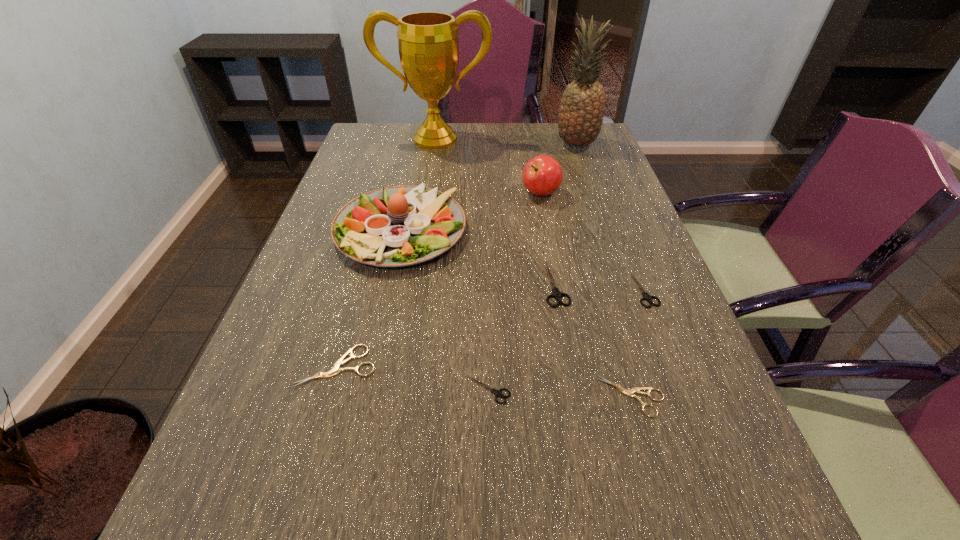
At what (x,y) coordinates should I click in order to perform the action: click on gold award. Please return your answer as a coordinate pair (x, y). Looking at the image, I should click on (428, 44).

You are a GUI agent. You are given a task and a screenshot of the screen. Output one action in this format:
    pyautogui.click(x=<x>, y=<y>)
    Task: Click on the pineapple
    
    Given the screenshot: What is the action you would take?
    pyautogui.click(x=580, y=118)

The image size is (960, 540). What are the coordinates of `red apple` in the screenshot? It's located at pos(542,175).

Locate an element on the screen. The height and width of the screenshot is (540, 960). salad plate is located at coordinates (397, 226).

The image size is (960, 540). I want to click on the tallest shears, so click(x=556, y=293).

Where is `the second black shears from left to right`? The image size is (960, 540). the second black shears from left to right is located at coordinates (556, 293).

At what (x,y) coordinates should I click in order to perform the action: click on the rightmost shears. Please return your answer as a coordinate pair (x, y). Image resolution: width=960 pixels, height=540 pixels. Looking at the image, I should click on (646, 296).

Where is `the rightmost black shears`? The width and height of the screenshot is (960, 540). the rightmost black shears is located at coordinates (646, 296).

Find the location of a particular element. the left beige shears is located at coordinates (336, 369).

Locate an element on the screen. This screenshot has height=540, width=960. the leftmost shears is located at coordinates 336,369.